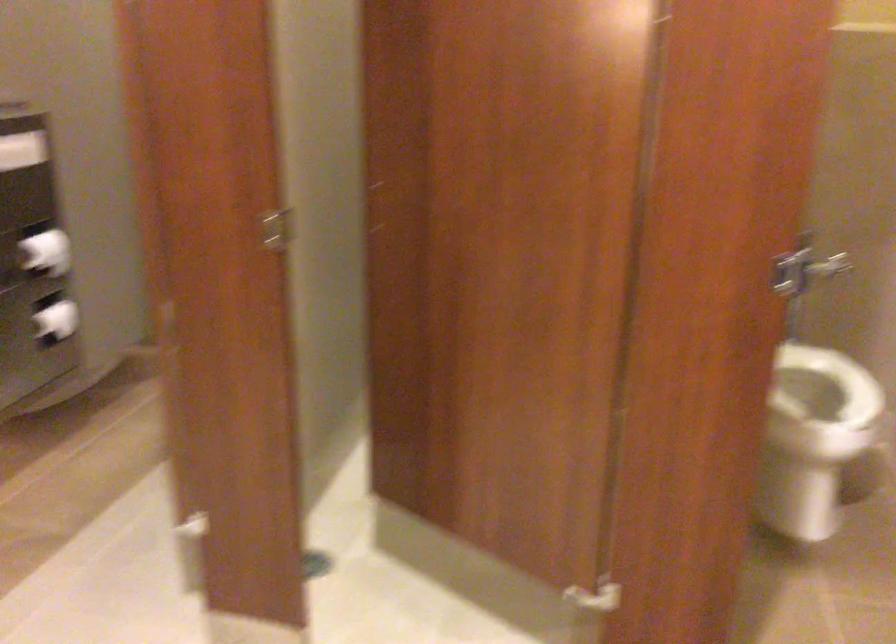
Locate an element on the screen. The width and height of the screenshot is (896, 644). stall door lock is located at coordinates (274, 230).